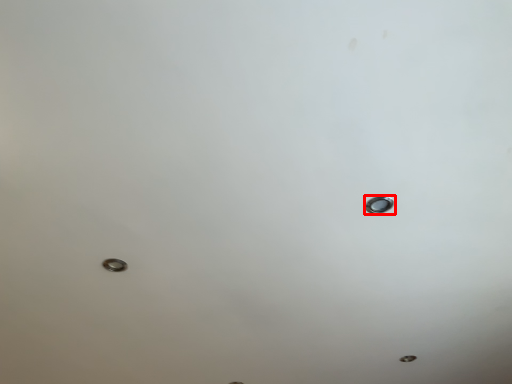
Question: From the image, what is the correct spatial relationship of nail (annotated by the red box) in relation to bolt?

Choices:
 (A) left
 (B) right

Answer: (B)